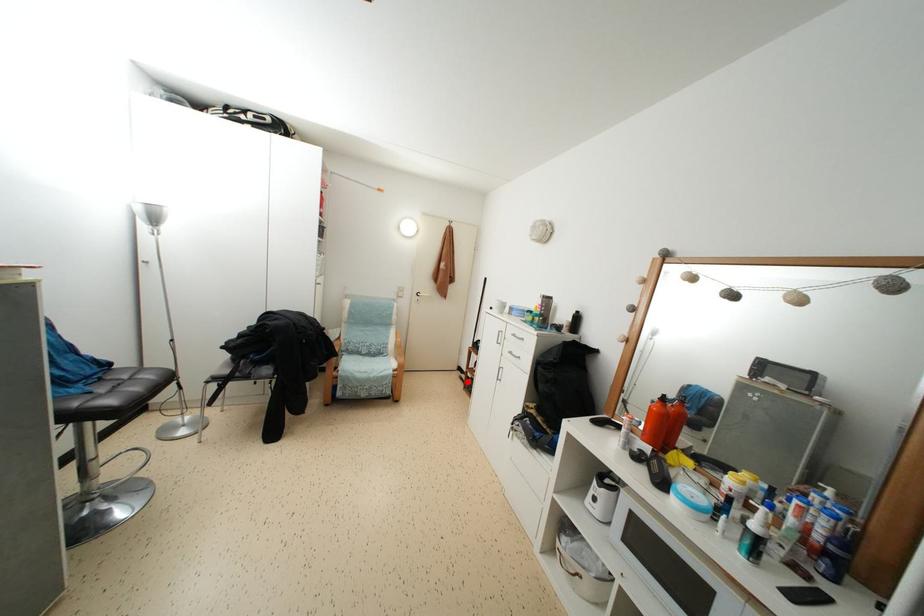
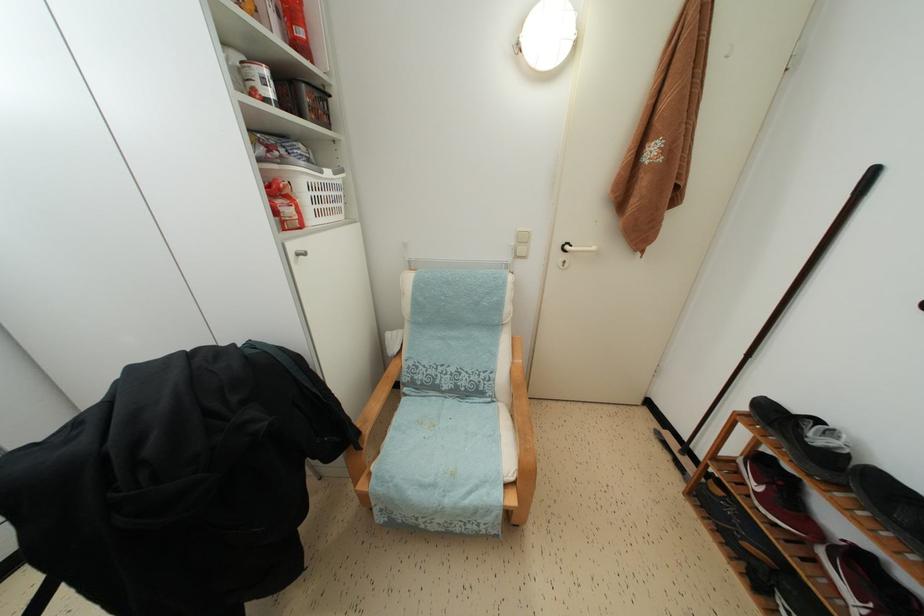
The point at the highlighted location is marked in the first image. Where is the corresponding point in the second image?

(678, 450)